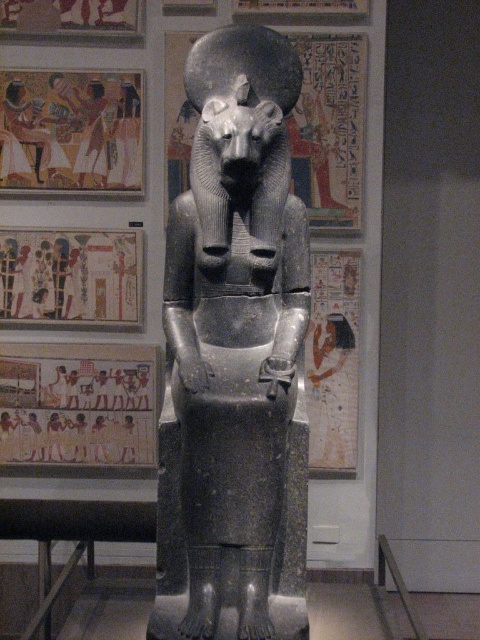
Question: Estimate the real-world distances between objects in this image. Which object is farther from the matte stone mural at left?

Choices:
 (A) black stone statue at center
 (B) matte stone hieroglyphics at center

Answer: (A)

Question: Does black stone statue at center come behind matte stone mural at left?

Choices:
 (A) no
 (B) yes

Answer: (A)

Question: Which point is farther from the camera taking this photo?

Choices:
 (A) (301, 369)
 (B) (123, 276)
 (C) (76, 189)
 (D) (59, 451)

Answer: (D)

Question: Can you confirm if matte stone hieroglyphics at center is bigger than matte stone mural at left?

Choices:
 (A) no
 (B) yes

Answer: (B)

Question: Which object is farther from the camera taking this photo?

Choices:
 (A) matte stone hieroglyphics at center
 (B) black stone statue at center

Answer: (A)

Question: Is earthy clay figures at upper left bigger than matte stone mural at left?

Choices:
 (A) no
 (B) yes

Answer: (B)